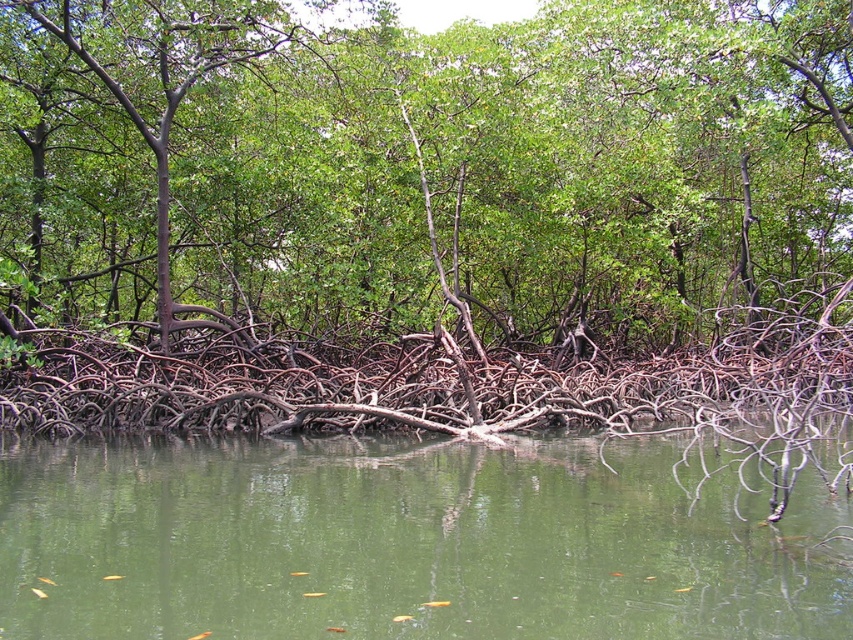
Which of these two, brown rough tree roots at center or green matte tree at center, stands shorter?

With less height is green matte tree at center.

Is point (521, 307) farther from viewer compared to point (219, 45)?

Yes, point (521, 307) is farther from viewer.

Is point (643, 275) positioned before point (213, 52)?

No, it is not.

Locate an element on the screen. brown rough tree roots at center is located at coordinates (422, 161).

In the scene shown: Who is more forward, (x=177, y=202) or (x=283, y=600)?

Positioned in front is point (x=283, y=600).

Based on the photo, does brown rough tree roots at center appear over green murky water at lower center?

Correct, brown rough tree roots at center is located above green murky water at lower center.

Does point (212, 52) come farther from viewer compared to point (461, 456)?

Yes, it is behind point (461, 456).

Find the location of a particular element. brown rough tree roots at center is located at coordinates (422, 161).

Does green murky water at lower center have a greater width compared to green matte tree at center?

Yes, green murky water at lower center is wider than green matte tree at center.

Does green murky water at lower center have a lesser width compared to green matte tree at center?

No, green murky water at lower center is not thinner than green matte tree at center.

Does point (54, 602) come farther from viewer compared to point (166, 188)?

No, it is not.

You are a GUI agent. You are given a task and a screenshot of the screen. Output one action in this format:
    pyautogui.click(x=<x>, y=<y>)
    Task: Click on the green murky water at lower center
    The width and height of the screenshot is (853, 640).
    Given the screenshot: What is the action you would take?
    click(403, 541)